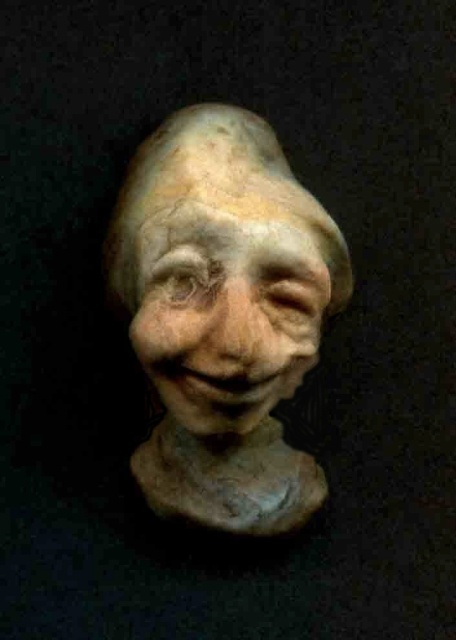
You are an art student who wants to place both the matte clay sculpture at center and the matte clay face at center on a small shelf. Given their sizes, which one should you place first to ensure they both fit?

The matte clay sculpture at center is larger in size than the matte clay face at center. To ensure both fit on the small shelf, place the larger matte clay sculpture at center first, then the smaller matte clay face at center.

You are an art student examining the matte clay sculpture at center and the matte clay face at center. Which object is wider?

The matte clay sculpture at center is wider than the matte clay face at center.

You are standing 1.2 meters away from a camera. You want to take a photo of the sculpted head. Is the point at coordinates point (186, 196) within your camera frame?

The point (186, 196) is 1.21 meters away from the camera, so since you are standing 1.2 meters away from the camera, the point is slightly further away from the camera than your current position. Therefore, the point may not be within your camera frame unless the camera has a wide enough angle to capture it.